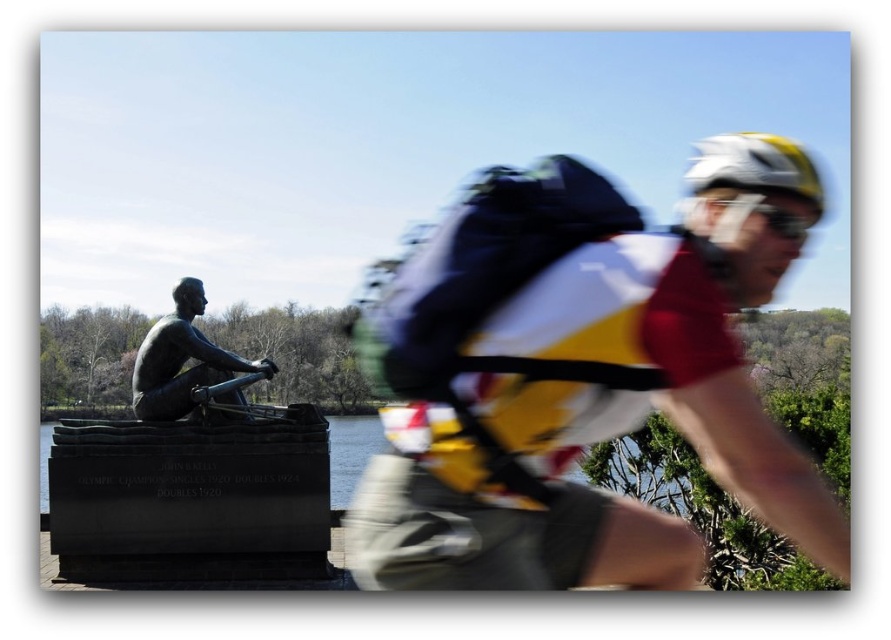
The height and width of the screenshot is (640, 891). Find the location of `bronze statue at left`. bronze statue at left is located at coordinates (182, 358).

The width and height of the screenshot is (891, 640). What do you see at coordinates (182, 358) in the screenshot?
I see `bronze statue at left` at bounding box center [182, 358].

Who is more forward, (151, 326) or (710, 156)?

Point (710, 156) is more forward.

The width and height of the screenshot is (891, 640). Find the location of `bronze statue at left`. bronze statue at left is located at coordinates (182, 358).

Which is below, clear water at statue left or bronze statue at left?

clear water at statue left is below.

What do you see at coordinates (648, 468) in the screenshot?
I see `clear water at statue left` at bounding box center [648, 468].

The image size is (891, 640). Describe the element at coordinates (648, 468) in the screenshot. I see `clear water at statue left` at that location.

At what (x,y) coordinates should I click in order to perform the action: click on clear water at statue left. Please return your answer as a coordinate pair (x, y). This screenshot has width=891, height=640. Looking at the image, I should click on (648, 468).

Which is more to the left, yellow and white jersey at center or bronze statue at left?

Positioned to the left is bronze statue at left.

Who is higher up, yellow and white jersey at center or bronze statue at left?

yellow and white jersey at center

Locate an element on the screen. This screenshot has height=640, width=891. yellow and white jersey at center is located at coordinates (579, 376).

Where is `yellow and white jersey at center`? This screenshot has width=891, height=640. yellow and white jersey at center is located at coordinates (579, 376).